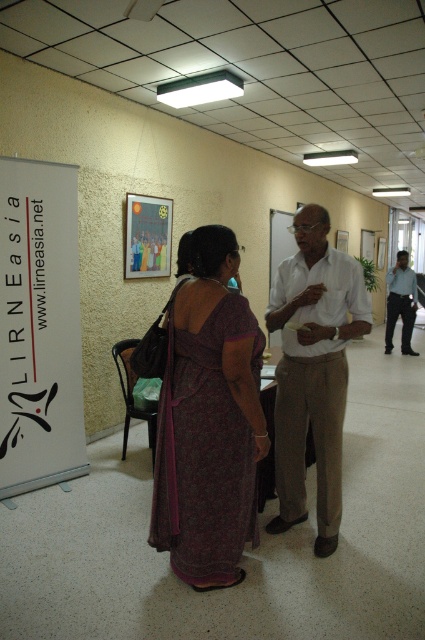
Question: Observing the image, what is the correct spatial positioning of white paper at left in reference to white cotton shirt at center?

Choices:
 (A) right
 (B) left

Answer: (B)

Question: Does white paper at left appear on the right side of matte paper poster at upper center?

Choices:
 (A) no
 (B) yes

Answer: (A)

Question: Which point is closer to the camera taking this photo?

Choices:
 (A) (385, 330)
 (B) (232, 352)

Answer: (B)

Question: Which point is farther to the camera?

Choices:
 (A) (294, 365)
 (B) (414, 305)
 (C) (138, 246)
 (D) (243, 477)

Answer: (B)

Question: Estimate the real-world distances between objects in this image. Which object is farther from the white paper at left?

Choices:
 (A) matte paper poster at upper center
 (B) white cotton shirt at center

Answer: (B)

Question: Does white paper at left have a smaller size compared to blue shirt at center?

Choices:
 (A) no
 (B) yes

Answer: (B)